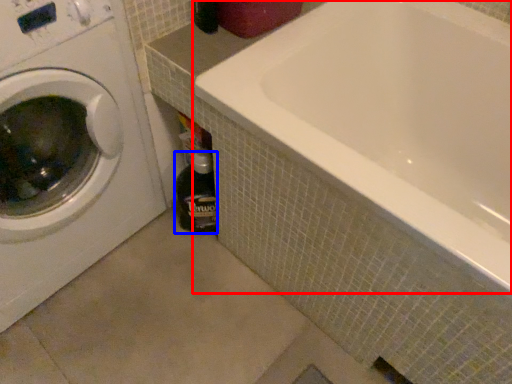
Question: Which point is closer to the camera, bathtub (highlighted by a red box) or bottle (highlighted by a blue box)?

Choices:
 (A) bathtub
 (B) bottle

Answer: (A)